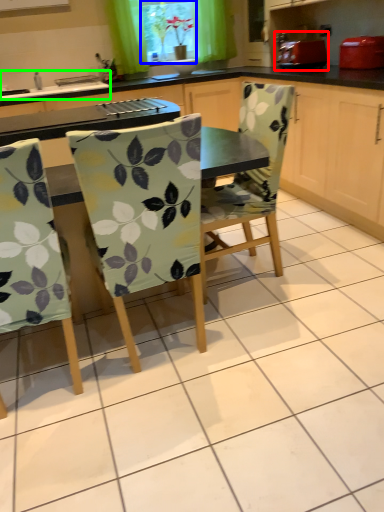
Question: Which object is the closest to the appliance (highlighted by a red box)? Choose among these: window screen (highlighted by a blue box) or sink (highlighted by a green box).

Choices:
 (A) window screen
 (B) sink

Answer: (A)